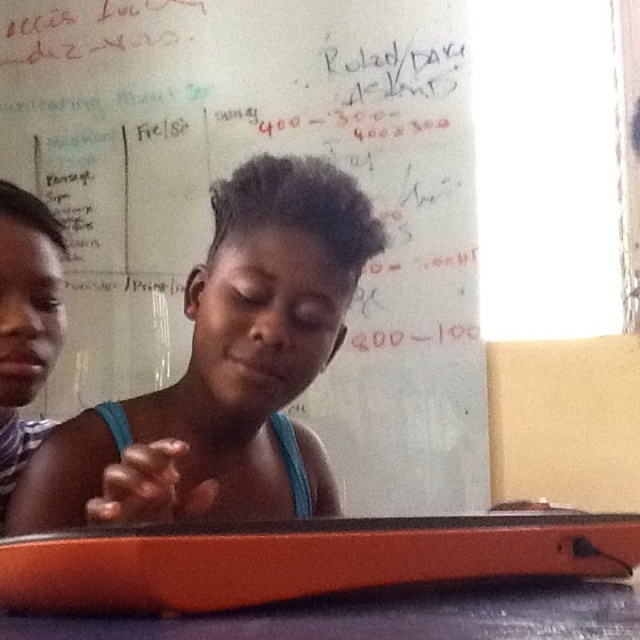
Question: Can you confirm if whiteboard at upper center is positioned below blue glossy table at lower center?

Choices:
 (A) no
 (B) yes

Answer: (A)

Question: Among these points, which one is nearest to the camera?

Choices:
 (A) (109, 51)
 (B) (380, 604)
 (C) (237, 529)

Answer: (C)

Question: Is orange plastic tray at lower center to the right of blue glossy table at lower center from the viewer's perspective?

Choices:
 (A) yes
 (B) no

Answer: (B)

Question: Which of these objects is positioned closest to the orange plastic tray at lower center?

Choices:
 (A) whiteboard at upper center
 (B) blue glossy table at lower center

Answer: (B)

Question: Which object is closer to the camera taking this photo?

Choices:
 (A) whiteboard at upper center
 (B) orange plastic tray at lower center

Answer: (B)

Question: Is orange plastic tray at lower center above striped fabric shirt at left?

Choices:
 (A) yes
 (B) no

Answer: (B)